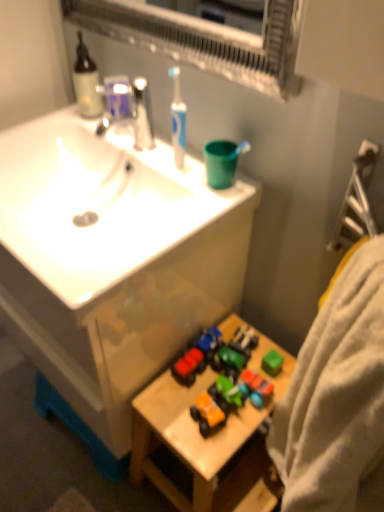
Locate an element on the screen. The height and width of the screenshot is (512, 384). free space in front of green matte toy car at lower center, the first toy from the right is located at coordinates (241, 428).